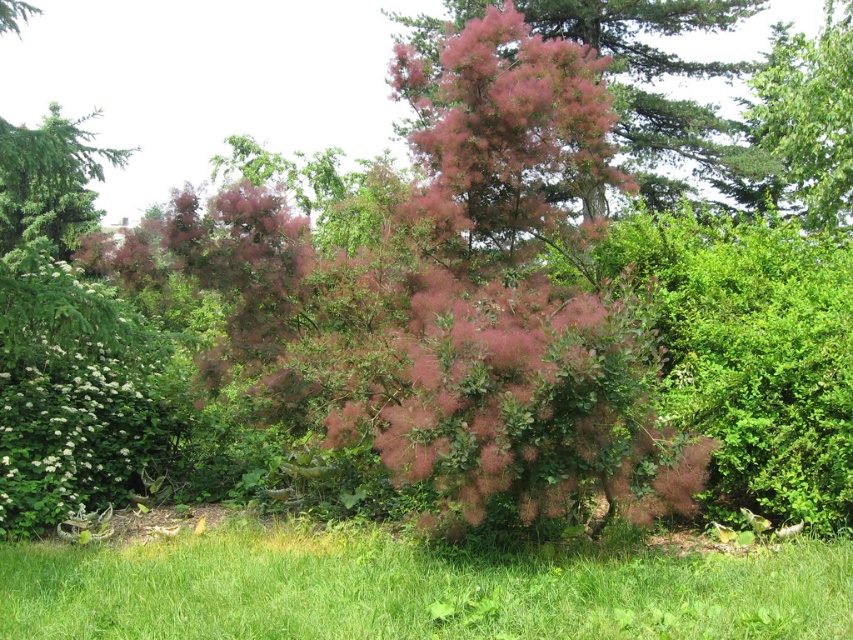
Question: Can you confirm if pink fluffy bush at center is positioned below green leafy tree at upper right?

Choices:
 (A) no
 (B) yes

Answer: (B)

Question: Does pink fluffy bush at center have a greater width compared to green textured tree at upper left?

Choices:
 (A) yes
 (B) no

Answer: (B)

Question: Does white fluffy bush at lower left appear on the right side of green leafy tree at upper right?

Choices:
 (A) yes
 (B) no

Answer: (B)

Question: Estimate the real-world distances between objects in this image. Which object is closer to the green grass at lower center?

Choices:
 (A) white fluffy bush at lower left
 (B) green leafy tree at upper right

Answer: (A)

Question: Which is nearer to the white fluffy bush at lower left?

Choices:
 (A) green textured tree at upper left
 (B) pink fluffy bush at center

Answer: (A)

Question: Which point appears farthest from the camera in this image?

Choices:
 (A) (828, 189)
 (B) (48, 141)

Answer: (A)